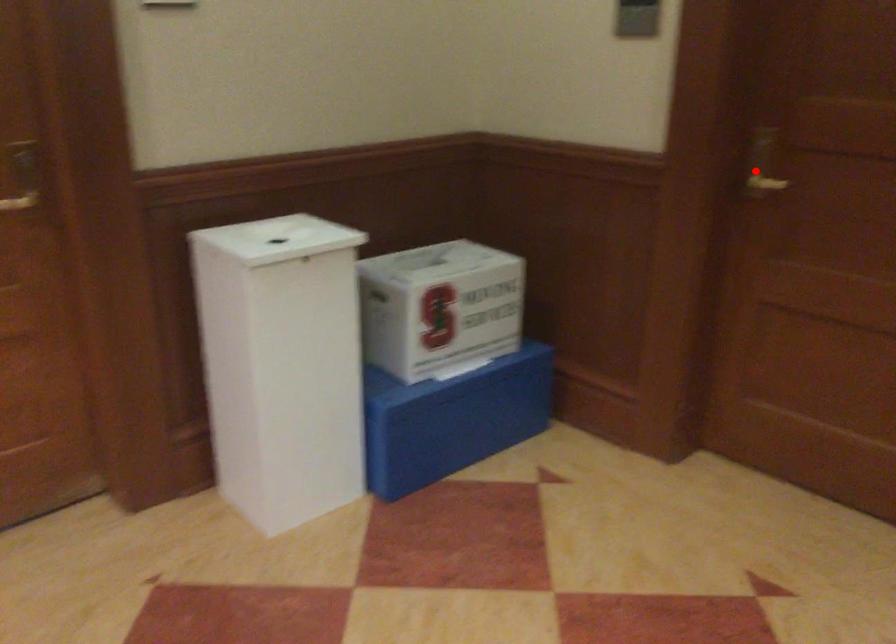
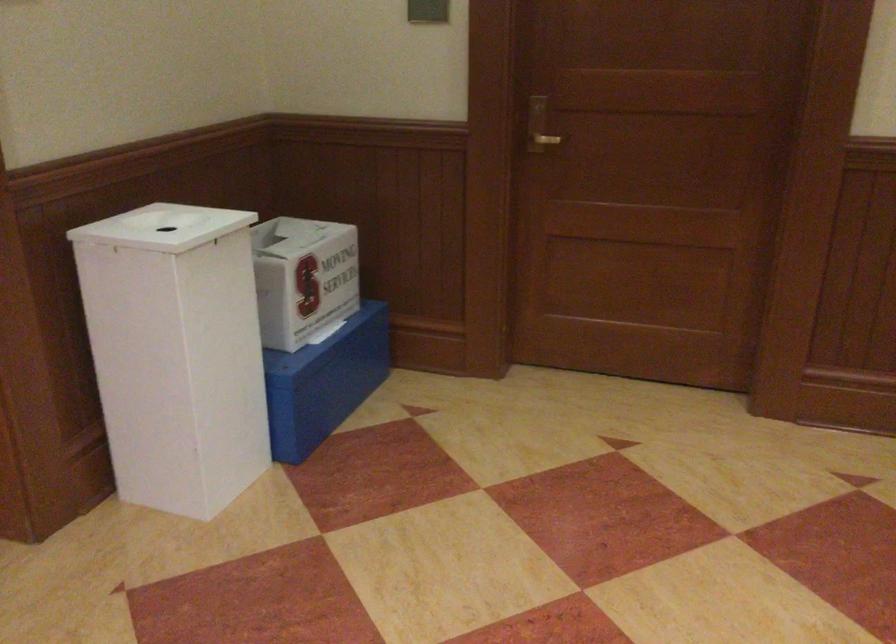
Where in the second image is the point corresponding to the highlighted location from the first image?

(538, 126)